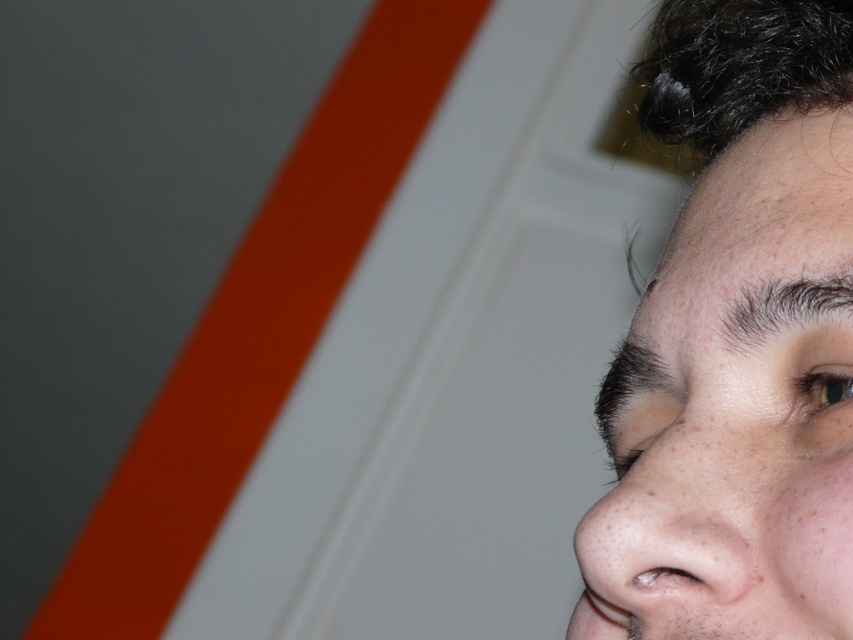
Is smooth skin face at upper right behind dark brown hair at upper right?

No.

Find the location of `smooth skin face at upper right`. smooth skin face at upper right is located at coordinates (735, 406).

Does dark brown curly hair at upper right have a lesser height compared to dark brown hair at upper right?

In fact, dark brown curly hair at upper right may be taller than dark brown hair at upper right.

Identify the location of dark brown curly hair at upper right. (732, 72).

Image resolution: width=853 pixels, height=640 pixels. Identify the location of dark brown curly hair at upper right. (732, 72).

Where is `dark brown curly hair at upper right`? dark brown curly hair at upper right is located at coordinates (732, 72).

Can you confirm if smooth skin face at upper right is wider than dark brown curly hair at upper right?

Yes, smooth skin face at upper right is wider than dark brown curly hair at upper right.

Who is positioned more to the left, smooth skin face at upper right or dark brown curly hair at upper right?

smooth skin face at upper right is more to the left.

In order to click on smooth skin face at upper right in this screenshot , I will do `click(735, 406)`.